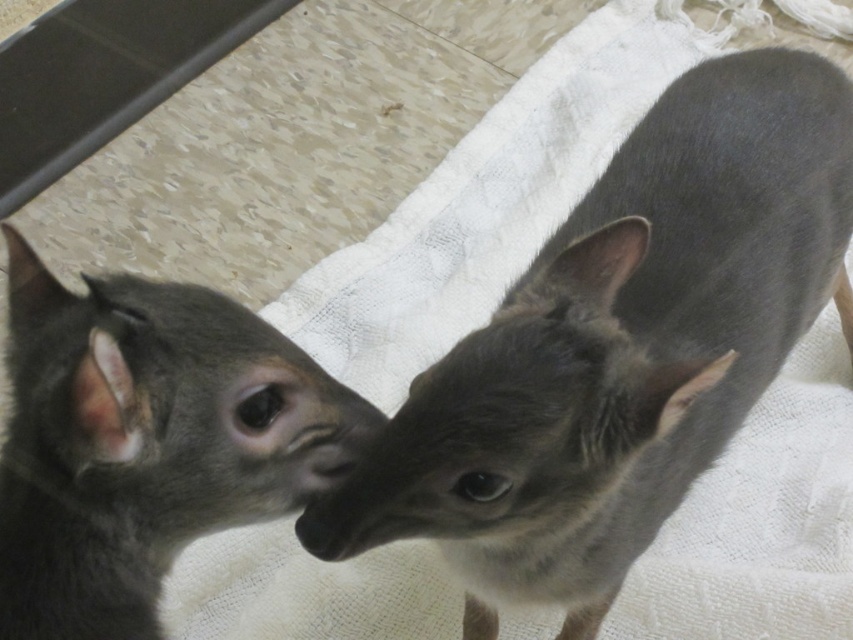
You are a photographer setting up a shoot with two dogs. You have a smooth gray chihuahua at center and a gray matte fur at center. Which dog is positioned to the right of the other?

The smooth gray chihuahua at center is to the right of gray matte fur at center.

In the scene shown: You are a photographer setting up a tripod to capture the smooth gray chihuahua at center. The tripod requires a minimum of 0.3 meters of space in front of the subject to avoid obstruction. Given the chihuahua is at coordinates point 0.544, 0.728, can you determine if there is sufficient space in front of it to set up the tripod without blocking the view?

The smooth gray chihuahua at center is located at point (619, 348). Since the y coordinate is 0.728, which is closer to the bottom of the image, there is enough space above it to set up the tripod without obstruction. Therefore, the required 0.3 meters of space is available.

In the scene shown: You are a pet photographer setting up a photo shoot. You have a smooth gray chihuahua at center and a gray matte fur at center in your scene. Which object takes up more horizontal space in the image?

The smooth gray chihuahua at center might be wider than gray matte fur at center, so it likely takes up more horizontal space in the image.